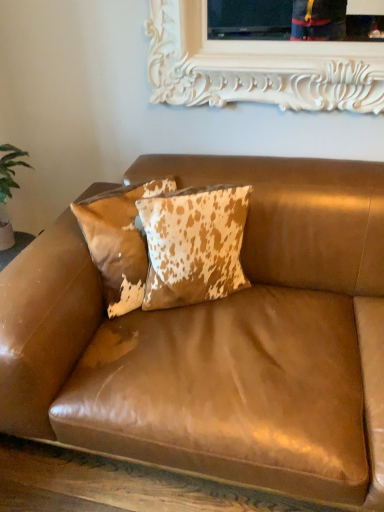
Question: Which direction should I rotate to face cowhide pillow at center, which is the 1th pillow from right to left, — up or down?

Choices:
 (A) up
 (B) down

Answer: (A)

Question: From the image's perspective, is brown leather couch at center on top of cowhide pillow at center, the second pillow viewed from the left?

Choices:
 (A) no
 (B) yes

Answer: (A)

Question: Is the position of brown leather couch at center less distant than that of cowhide pillow at center, which is the 1th pillow from right to left?

Choices:
 (A) yes
 (B) no

Answer: (A)

Question: Is brown leather couch at center oriented away from cowhide pillow at center, the second pillow viewed from the left?

Choices:
 (A) yes
 (B) no

Answer: (A)

Question: From the image's perspective, is brown leather couch at center located beneath cowhide pillow at center, the second pillow viewed from the left?

Choices:
 (A) no
 (B) yes

Answer: (B)

Question: Is brown leather couch at center next to cowhide pillow at center, the second pillow viewed from the left?

Choices:
 (A) no
 (B) yes

Answer: (A)

Question: Is brown leather couch at center wider than cowhide pillow at center, the second pillow viewed from the left?

Choices:
 (A) no
 (B) yes

Answer: (B)

Question: Can cowhide pillow at center, positioned as the second pillow in right-to-left order, be found inside brown leather couch at center?

Choices:
 (A) yes
 (B) no

Answer: (A)

Question: Is brown leather couch at center further to camera compared to cowhide pillow at center, positioned as the second pillow in right-to-left order?

Choices:
 (A) yes
 (B) no

Answer: (B)

Question: Is brown leather couch at center facing away from cowhide pillow at center, positioned as the second pillow in right-to-left order?

Choices:
 (A) yes
 (B) no

Answer: (A)

Question: Can you confirm if brown leather couch at center is shorter than cowhide pillow at center, the first pillow in the left-to-right sequence?

Choices:
 (A) yes
 (B) no

Answer: (B)

Question: Can you confirm if brown leather couch at center is taller than cowhide pillow at center, the first pillow in the left-to-right sequence?

Choices:
 (A) no
 (B) yes

Answer: (B)

Question: From a real-world perspective, is brown leather couch at center below cowhide pillow at center, positioned as the second pillow in right-to-left order?

Choices:
 (A) yes
 (B) no

Answer: (A)

Question: From the image's perspective, does cowhide pillow at center, the first pillow in the left-to-right sequence, appear lower than cowhide pillow at center, which is the 1th pillow from right to left?

Choices:
 (A) yes
 (B) no

Answer: (B)